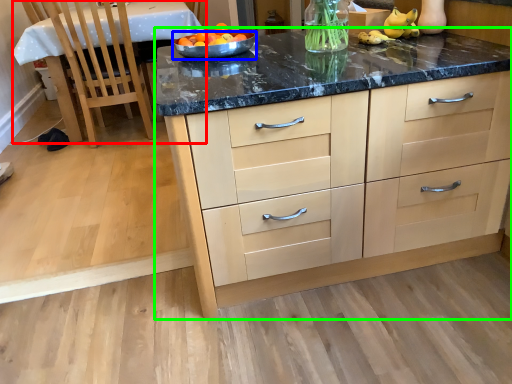
Question: Considering the real-world distances, which object is closest to table (highlighted by a red box)? bowl (highlighted by a blue box) or cabinetry (highlighted by a green box).

Choices:
 (A) bowl
 (B) cabinetry

Answer: (A)